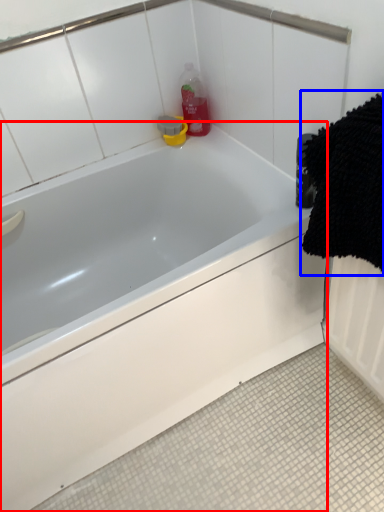
Question: Among these objects, which one is nearest to the camera, bathtub (highlighted by a red box) or bath towel (highlighted by a blue box)?

Choices:
 (A) bathtub
 (B) bath towel

Answer: (B)